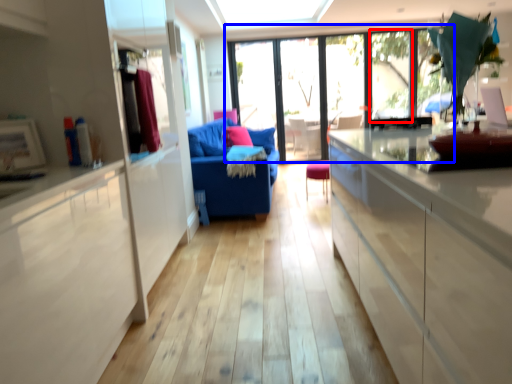
Question: Which of the following is the farthest to the observer, window (highlighted by a red box) or window (highlighted by a blue box)?

Choices:
 (A) window
 (B) window

Answer: (B)